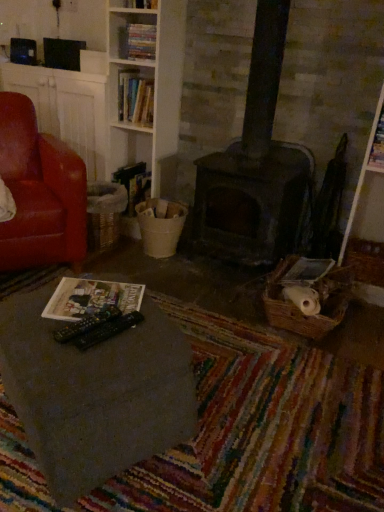
Identify the location of free point in front of matte paper magazine at lower left, the 1th magazine ordered from the bottom. (79, 352).